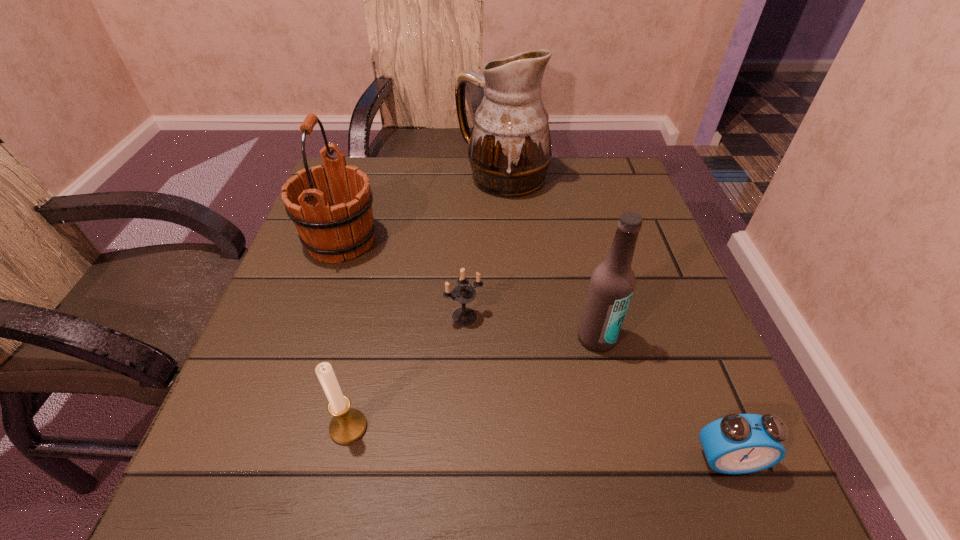
Locate an element on the screen. object that is at the near right corner is located at coordinates (738, 443).

At what (x,y) coordinates should I click in order to perform the action: click on vacant space at the far edge of the desktop. Please return your answer as a coordinate pair (x, y). Looking at the image, I should click on (461, 161).

Identify the location of vacant area at the near edge. (327, 465).

The height and width of the screenshot is (540, 960). In order to click on vacant space at the left edge in this screenshot , I will do `click(288, 293)`.

Find the location of a particular element. The height and width of the screenshot is (540, 960). free space at the right edge of the desktop is located at coordinates 607,237.

Where is `free space at the far left corner of the desktop`? Image resolution: width=960 pixels, height=540 pixels. free space at the far left corner of the desktop is located at coordinates (374, 197).

In the image, there is a desktop. Where is `blank space at the near left corner`? This screenshot has width=960, height=540. blank space at the near left corner is located at coordinates (204, 496).

Find the location of a particular element. This screenshot has height=540, width=960. free space between the alarm clock and the beer bottle is located at coordinates (661, 399).

Find the location of a particular element. This screenshot has height=540, width=960. vacant area that lies between the taller candle holder and the wine bucket is located at coordinates (345, 334).

Where is `vacant space that's between the taller candle holder and the wine bucket`? This screenshot has width=960, height=540. vacant space that's between the taller candle holder and the wine bucket is located at coordinates (345, 334).